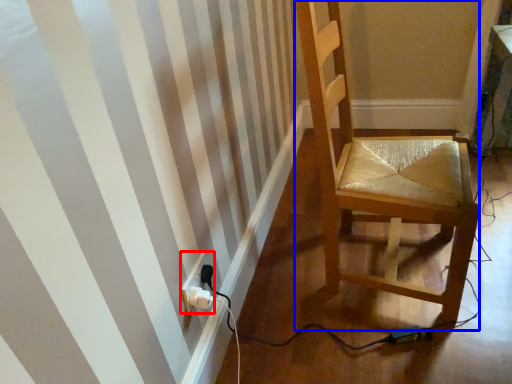
Question: Which object is further to the camera taking this photo, electric outlet (highlighted by a red box) or chair (highlighted by a blue box)?

Choices:
 (A) electric outlet
 (B) chair

Answer: (A)